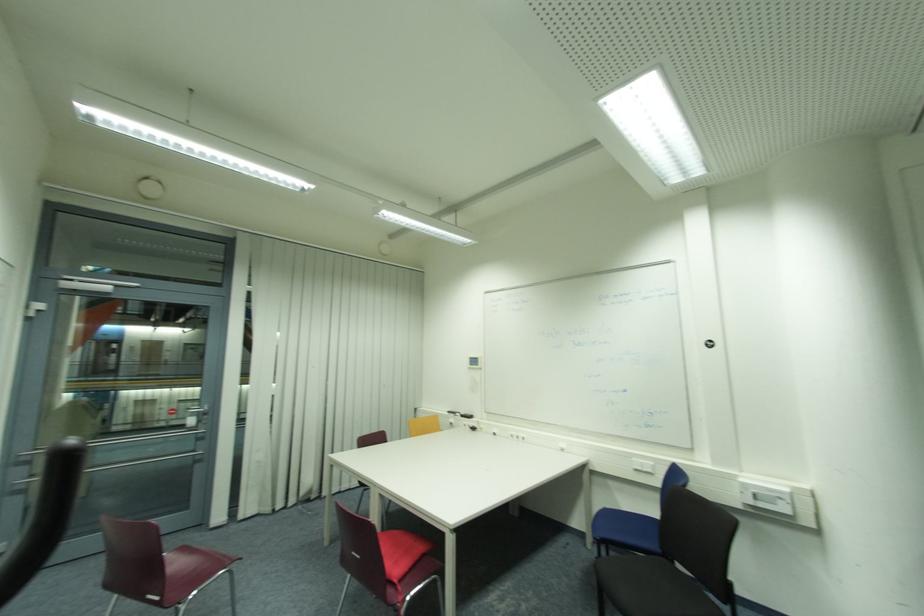
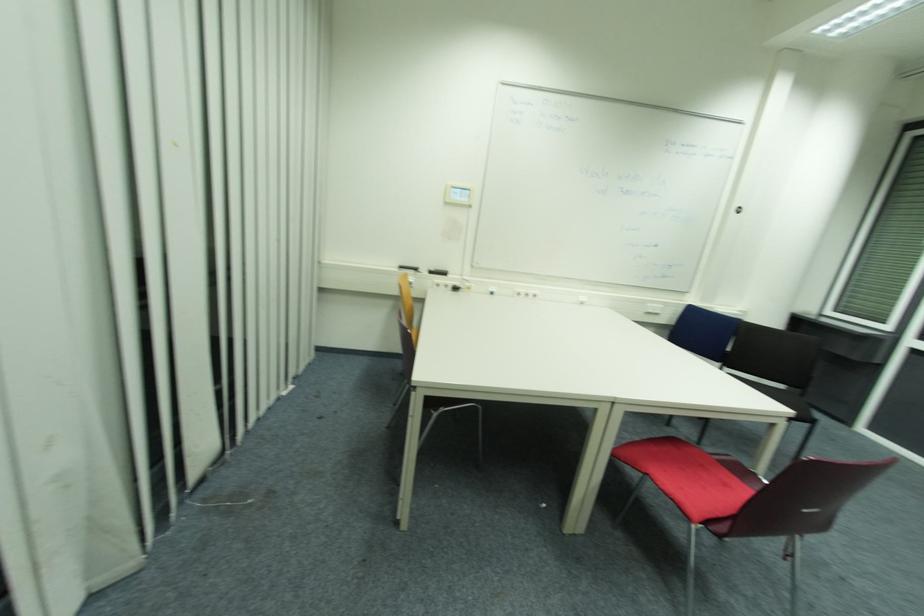
Where in the second image is the point corresponding to (647,462) from the first image?

(658, 306)